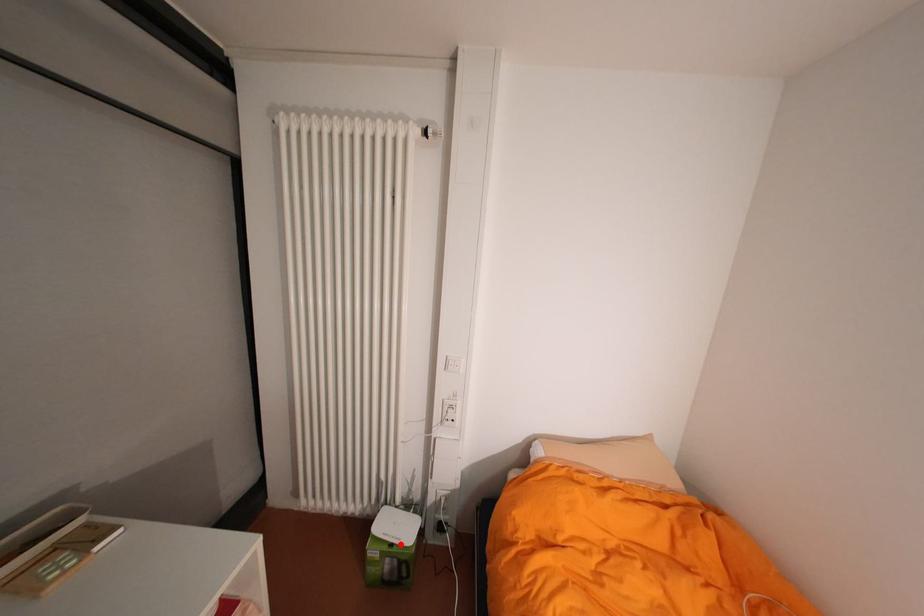
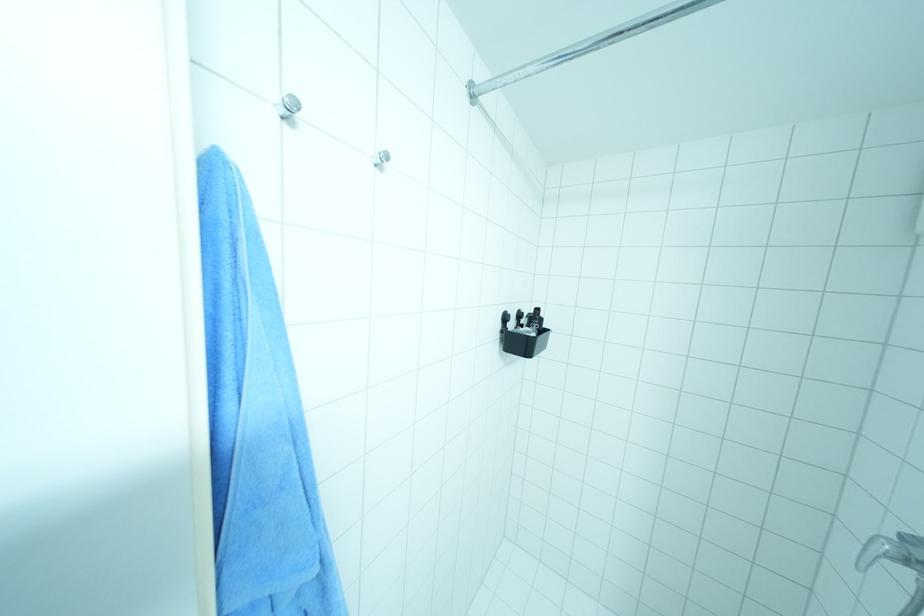
Question: I am providing you with two images of the same scene from different viewpoints. A red point is marked on the first image. Is the red point's position out of view in image 2?

Choices:
 (A) Yes
 (B) No

Answer: (A)